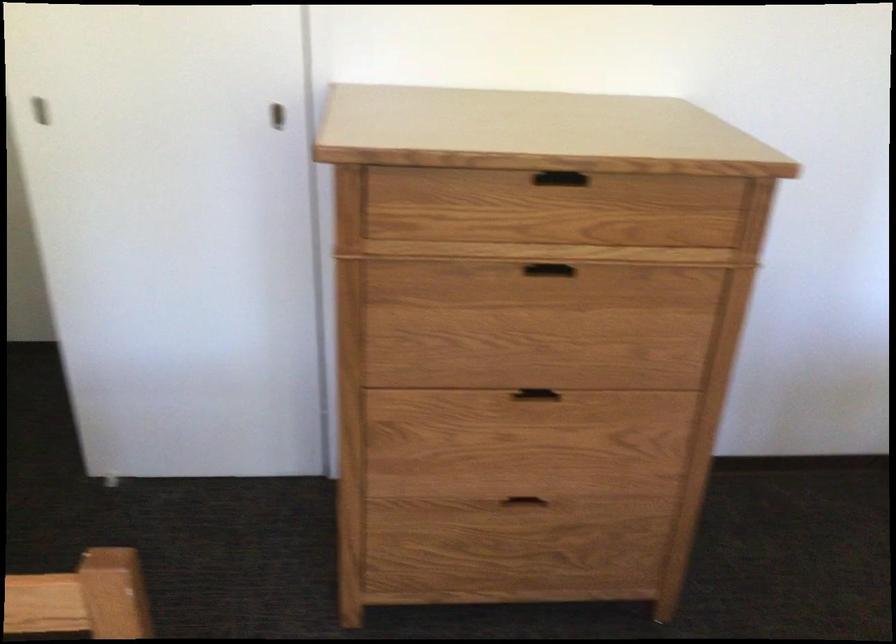
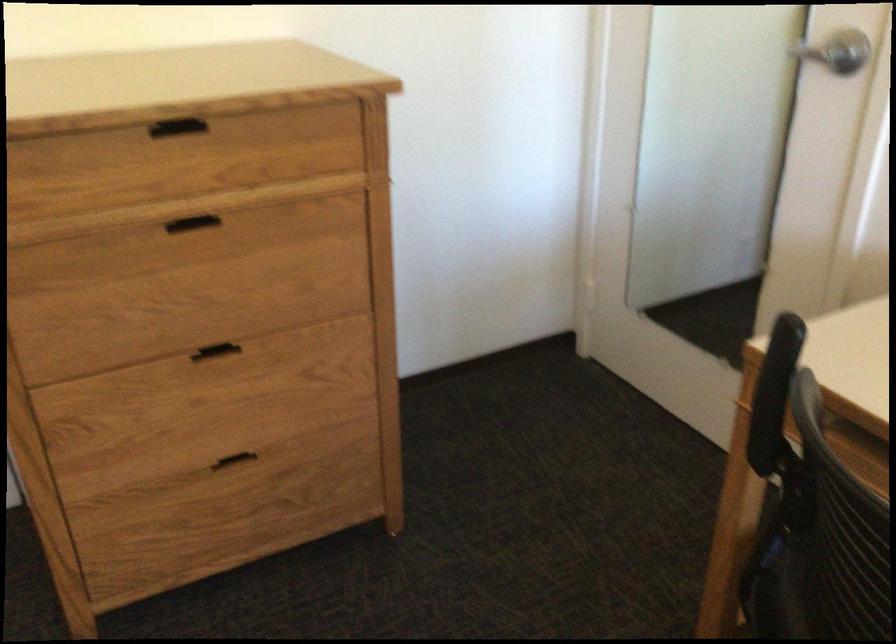
Find the pixel in the second image that matches [567,272] in the first image.

(211, 227)